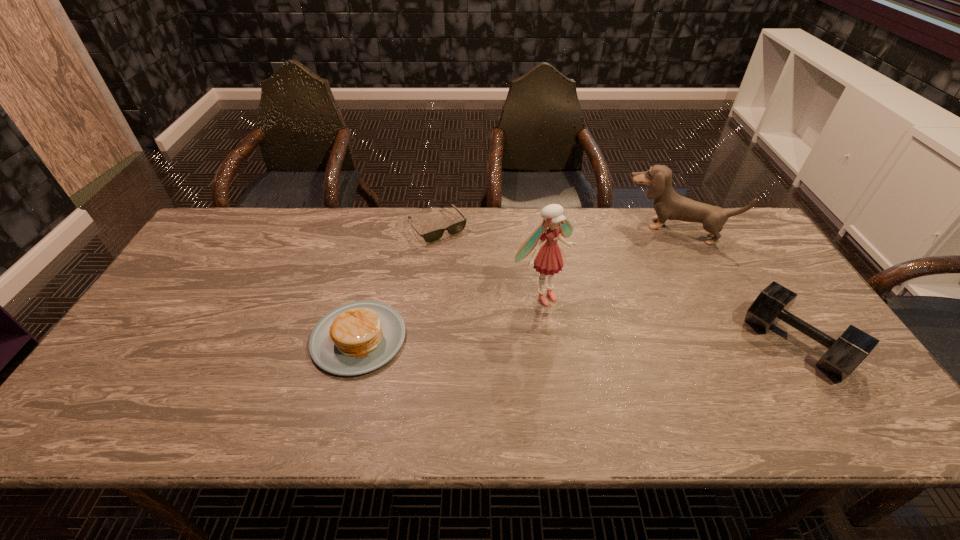
The width and height of the screenshot is (960, 540). What are the coordinates of `pancake` in the screenshot? It's located at (355, 338).

I want to click on the third shortest object, so pos(843,356).

This screenshot has height=540, width=960. In order to click on the fourth shortest object in this screenshot , I will do `click(668, 205)`.

The image size is (960, 540). In order to click on the shortest object in this screenshot , I will do `click(434, 235)`.

Where is `doll`? This screenshot has width=960, height=540. doll is located at coordinates (548, 259).

Identify the location of the third object from right to left. (548, 259).

Identify the location of free space located on the left of the pancake. The height and width of the screenshot is (540, 960). [x=205, y=338].

You are a GUI agent. You are given a task and a screenshot of the screen. Output one action in this format:
    pyautogui.click(x=<x>, y=<y>)
    Task: Click on the free location located 0.080m on the left of the third tallest object
    
    Given the screenshot: What is the action you would take?
    pyautogui.click(x=717, y=343)

This screenshot has height=540, width=960. I want to click on vacant region located at the face of the puppy, so pyautogui.click(x=649, y=269).

Where is `free space located 0.110m at the face of the puppy`? free space located 0.110m at the face of the puppy is located at coordinates (650, 265).